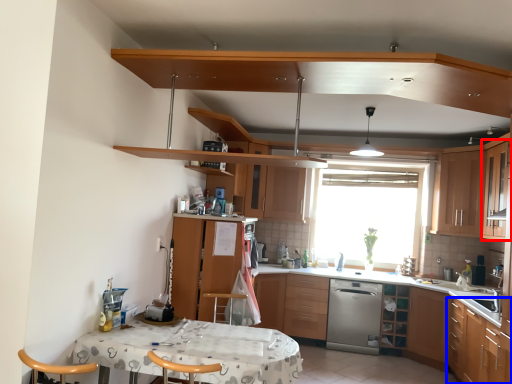
Question: Which object is closer to the camera taking this photo, cabinetry (highlighted by a red box) or cabinetry (highlighted by a blue box)?

Choices:
 (A) cabinetry
 (B) cabinetry

Answer: (B)